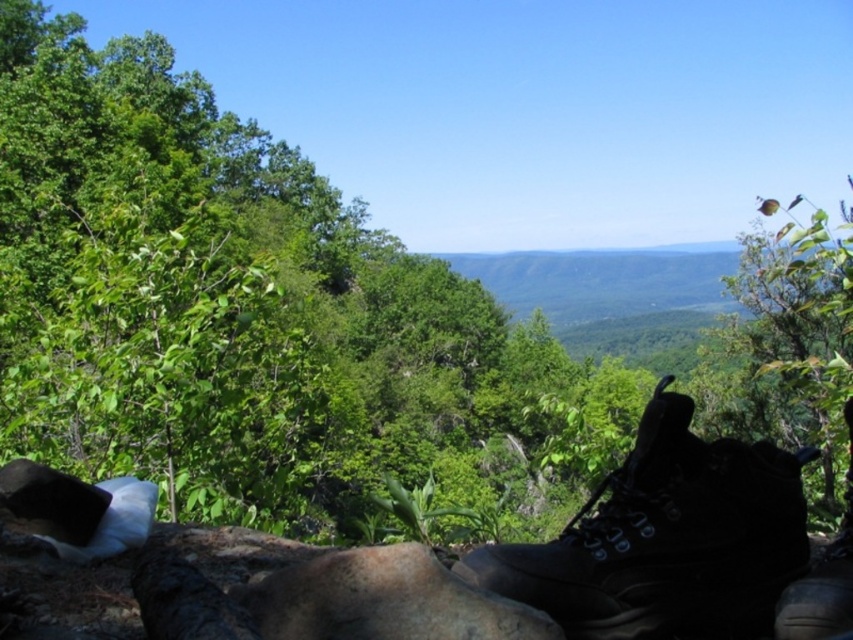
You are a photographer planning to capture a detailed closeup of the matte black boot at lower right and the black leather boot at lower right. Given their sizes in the image, which boot will appear smaller in your closeup photo?

The matte black boot at lower right occupies less space than the black leather boot at lower right, so it will appear smaller in the closeup photo.

Based on the photo, you are a photographer setting up a tripod in this scene. You need to place the tripod between the matte black boot at lower right and the black leather boot at lower right. Which boot should you position the tripod closer to if you want the tripod to be closer to the taller boot?

The matte black boot at lower right is taller than the black leather boot at lower right, so you should position the tripod closer to the matte black boot at lower right.